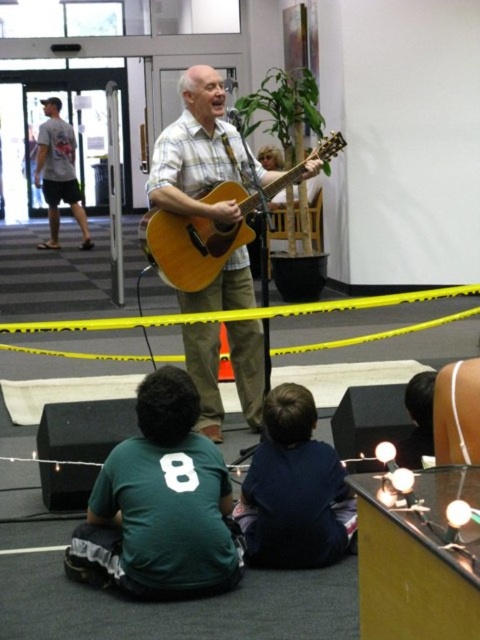
You are a photographer standing at the point labeled as point (71,176). You want to take a photo of the performer on stage. However, there is a child sitting at point (344,506) blocking your view. Can you move to a position where you can see the performer without the child blocking your shot?

Yes, you can move behind point (71,176) since point (344,506) is in front of it, so moving behind would allow you to have a clear view of the performer without the child blocking your shot.